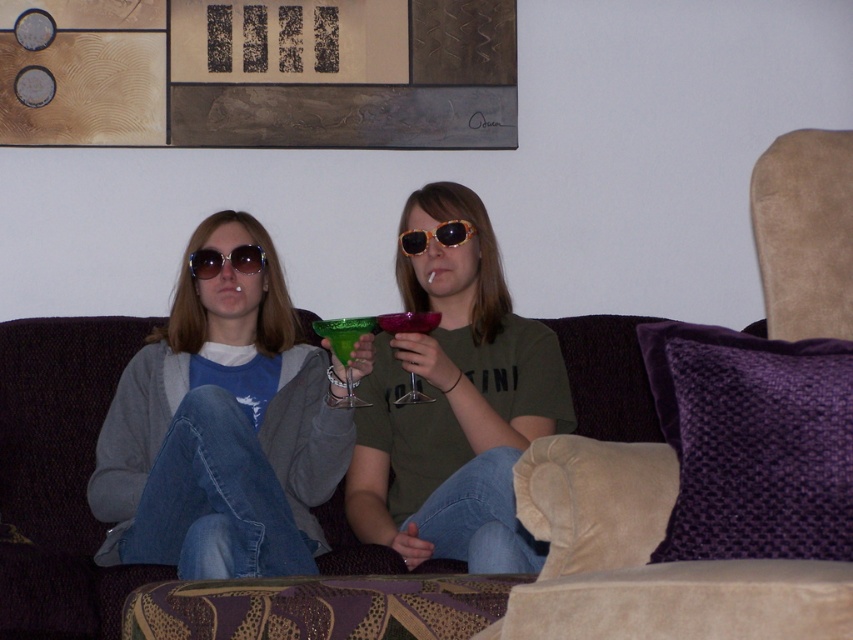
Question: Does green glass at center have a lesser width compared to sunglasses at center?

Choices:
 (A) no
 (B) yes

Answer: (B)

Question: Which point is farther to the camera?

Choices:
 (A) (439, 237)
 (B) (247, 372)

Answer: (B)

Question: Estimate the real-world distances between objects in this image. Which object is farther from the green matte glass at center?

Choices:
 (A) purple fabric couch at center
 (B) tortoiseshell plastic sunglasses at center
 (C) sunglasses at center

Answer: (A)

Question: Does green glass at center appear under tortoiseshell plastic sunglasses at center?

Choices:
 (A) yes
 (B) no

Answer: (A)

Question: Considering the relative positions of green glass at center and translucent plastic wine glass at center in the image provided, where is green glass at center located with respect to translucent plastic wine glass at center?

Choices:
 (A) right
 (B) left

Answer: (B)

Question: Which object is positioned farthest from the matte gray sweater at center?

Choices:
 (A) green matte glass at center
 (B) suede armchair at right

Answer: (B)